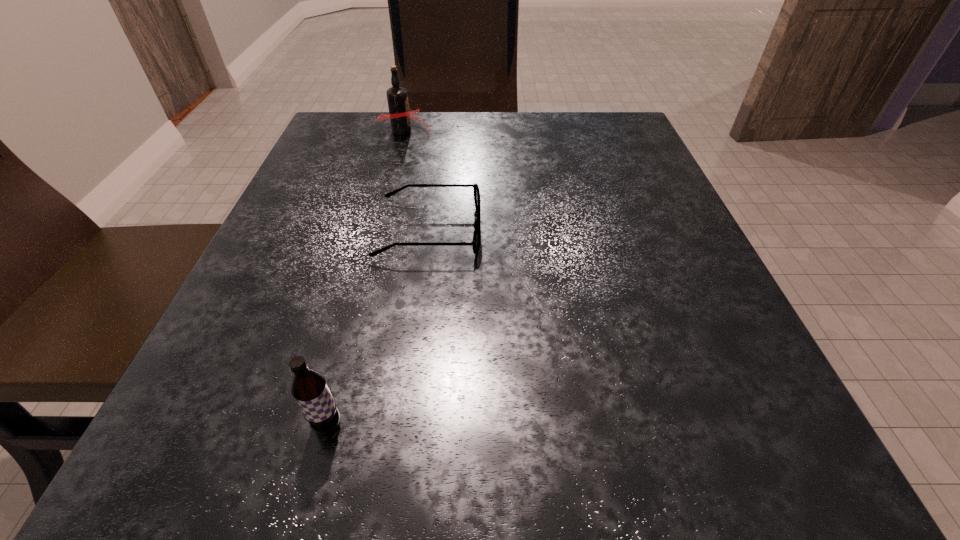
The height and width of the screenshot is (540, 960). I want to click on vacant space that's between the second tallest object and the farthest object, so click(x=365, y=278).

Identify the location of vacant area that lies between the shortest object and the shorter root beer. (378, 327).

Where is `free area in between the nearest object and the shortest object`? The image size is (960, 540). free area in between the nearest object and the shortest object is located at coordinates (378, 327).

At what (x,y) coordinates should I click in order to perform the action: click on free spot between the nearer root beer and the farthest object. Please return your answer as a coordinate pair (x, y). Looking at the image, I should click on (365, 278).

Find the location of `free area in between the second shortest object and the farther root beer`. free area in between the second shortest object and the farther root beer is located at coordinates coord(365,278).

This screenshot has height=540, width=960. Find the location of `free point between the nearest object and the farthest object`. free point between the nearest object and the farthest object is located at coordinates (365, 278).

You are a GUI agent. You are given a task and a screenshot of the screen. Output one action in this format:
    pyautogui.click(x=<x>, y=<y>)
    Task: Click on the vacant region between the farthest object and the nearer root beer
    The image size is (960, 540).
    Given the screenshot: What is the action you would take?
    pyautogui.click(x=365, y=278)

Identify the location of free area in between the farthest object and the shortest object. The width and height of the screenshot is (960, 540). (416, 181).

This screenshot has width=960, height=540. What are the coordinates of `free space between the farthest object and the spectacles` in the screenshot? It's located at (416, 181).

Find the location of a particular element. blank region between the second farthest object and the farther root beer is located at coordinates (416, 181).